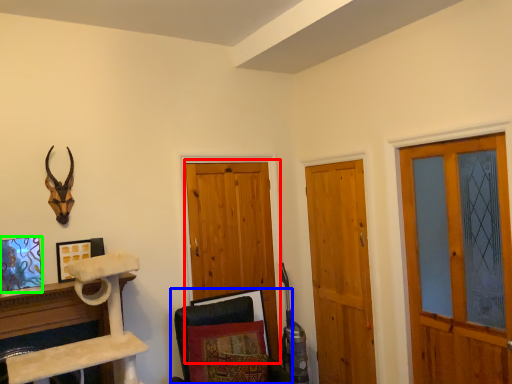
Question: Based on their relative distances, which object is nearer to barn door (highlighted by a red box)? Choose from swivel chair (highlighted by a blue box) and picture frame (highlighted by a green box).

Choices:
 (A) swivel chair
 (B) picture frame

Answer: (A)